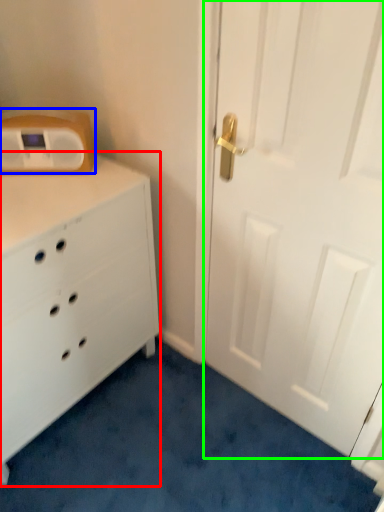
Question: Which is farther away from chest of drawers (highlighted by a red box)? appliance (highlighted by a blue box) or door (highlighted by a green box)?

Choices:
 (A) appliance
 (B) door

Answer: (B)